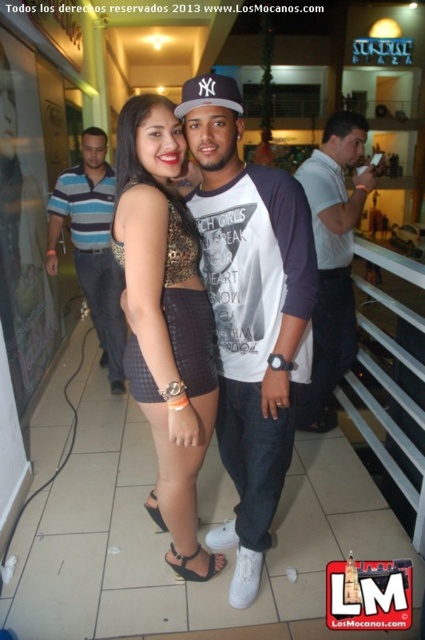
Question: Considering the real-world distances, which object is closest to the white fabric baseball cap at center?

Choices:
 (A) white cotton t-shirt at center
 (B) leopard print dress at center
 (C) white cotton shirt at center
 (D) striped polo shirt at left

Answer: (B)

Question: In this image, where is white cotton t-shirt at center located relative to striped polo shirt at left?

Choices:
 (A) above
 (B) below

Answer: (B)

Question: Is white cotton t-shirt at center below leopard print dress at center?

Choices:
 (A) no
 (B) yes

Answer: (B)

Question: Can you confirm if leopard print dress at center is thinner than striped polo shirt at left?

Choices:
 (A) yes
 (B) no

Answer: (A)

Question: Which object appears farthest from the camera in this image?

Choices:
 (A) striped polo shirt at left
 (B) white cotton t-shirt at center
 (C) leopard print dress at center

Answer: (A)

Question: Which is nearer to the white fabric baseball cap at center?

Choices:
 (A) white cotton shirt at center
 (B) white cotton t-shirt at center
 (C) striped polo shirt at left
 (D) leopard print dress at center

Answer: (D)